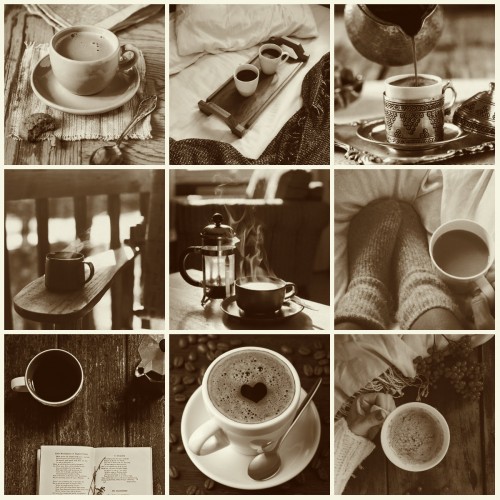
I want to click on cups of hot beverages possibly coffee or tea, so coord(406,434), coord(242,395), coord(73,389), coord(78,263), coord(272,302), coord(455,258), coord(423,111), coord(243,75), coord(273,54), coord(84,77).